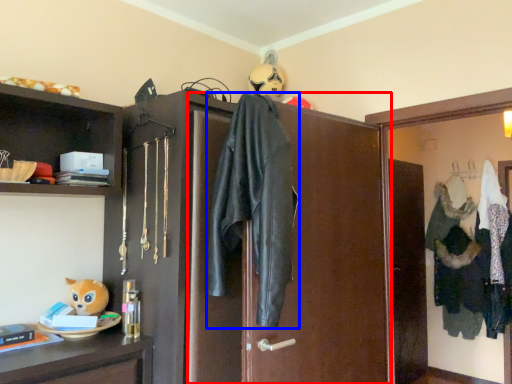
Question: Which object is further to the camera taking this photo, screen door (highlighted by a red box) or jacket (highlighted by a blue box)?

Choices:
 (A) screen door
 (B) jacket

Answer: (A)